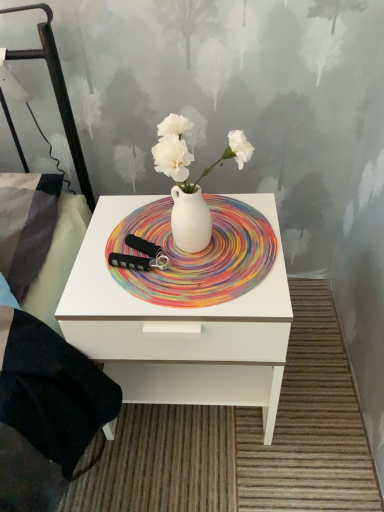
Image resolution: width=384 pixels, height=512 pixels. Find the location of `vacant area situated below white matte plate at center (from a real-world perspective)`. vacant area situated below white matte plate at center (from a real-world perspective) is located at coordinates (159, 233).